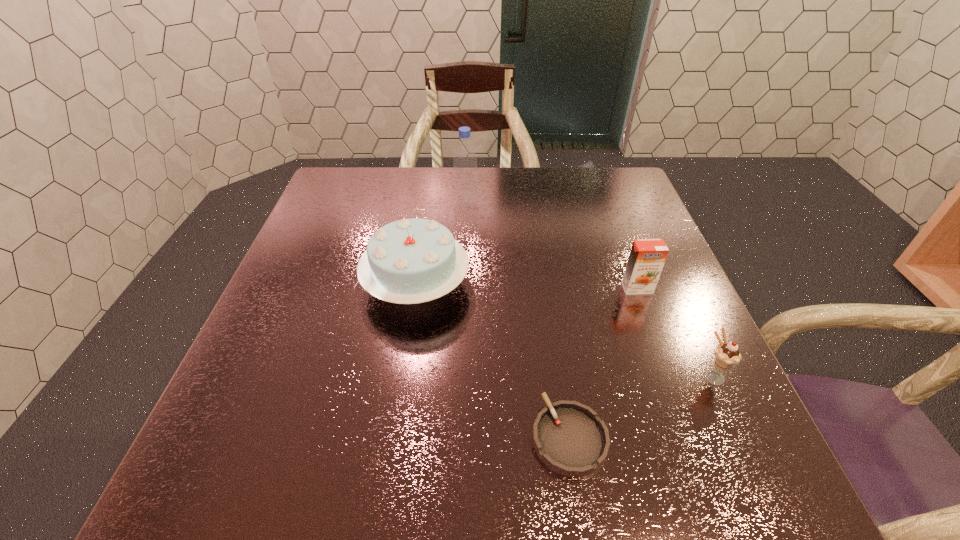
Find the location of `free point between the icecream and the farthest object`. free point between the icecream and the farthest object is located at coordinates (589, 289).

Identify the location of free space between the tallest object and the second object from right to left. The image size is (960, 540). (552, 245).

The image size is (960, 540). What are the coordinates of `free spot between the icecream and the orange juice` in the screenshot? It's located at (675, 332).

Locate an element on the screen. This screenshot has width=960, height=540. object that is the fourth closest to the fourth farthest object is located at coordinates (466, 194).

This screenshot has width=960, height=540. I want to click on the closest object to the farthest object, so click(x=409, y=261).

Where is `free location that satisfies the following two spatial constraints: 1. on the front side of the birthday cake; 2. on the right side of the orange juice`? This screenshot has height=540, width=960. free location that satisfies the following two spatial constraints: 1. on the front side of the birthday cake; 2. on the right side of the orange juice is located at coordinates (416, 288).

Locate an element on the screen. vacant region that satisfies the following two spatial constraints: 1. on the back side of the tallest object; 2. on the left side of the birthday cake is located at coordinates (428, 202).

You are a GUI agent. You are given a task and a screenshot of the screen. Output one action in this format:
    pyautogui.click(x=<x>, y=<y>)
    Task: Click on the vacant area that satisfies the following two spatial constraints: 1. on the front side of the second object from right to left; 2. on the right side of the icecream
    The image size is (960, 540).
    Given the screenshot: What is the action you would take?
    pyautogui.click(x=669, y=375)

Where is `vacant point that satisfies the following two spatial constraints: 1. on the front side of the fourth shortest object; 2. on the right side of the orange juice`? The image size is (960, 540). vacant point that satisfies the following two spatial constraints: 1. on the front side of the fourth shortest object; 2. on the right side of the orange juice is located at coordinates (416, 288).

Image resolution: width=960 pixels, height=540 pixels. What are the coordinates of `vacant space that satisfies the following two spatial constraints: 1. on the front side of the icecream; 2. on the right side of the fourth object from left to right` in the screenshot? It's located at (669, 375).